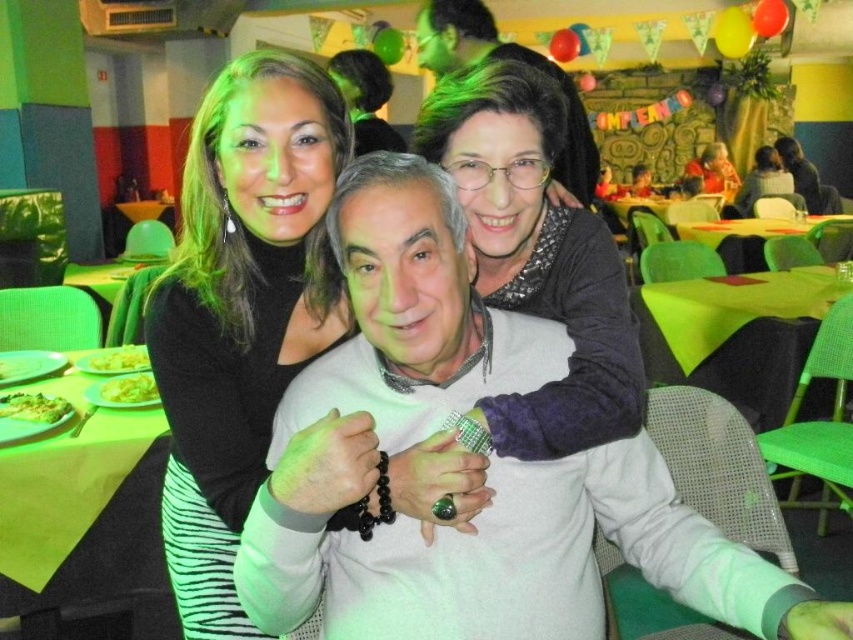
You are a waiter carrying a tray of dishes. You need to deliver the yellow matte pasta at center to the table where the matte black sweater at upper center is located. The hallway between them is 5 meters wide. Can you safely navigate the hallway with your tray?

The distance between the matte black sweater at upper center and the yellow matte pasta at center is 5.79 meters. Since the hallway is 5 meters wide, it is narrower than the required space. Therefore, you cannot safely navigate the hallway with your tray.

You are a photographer setting up a shot in this scene. You need to position a light source so that it illuminates both the matte black sweater at upper center and the yellow matte pasta at left. Given their positions, which object should be placed closer to the light source to ensure both receive adequate lighting?

The matte black sweater at upper center should be placed closer to the light source because it is located above the yellow matte pasta at left, so positioning it nearer ensures both receive sufficient light.